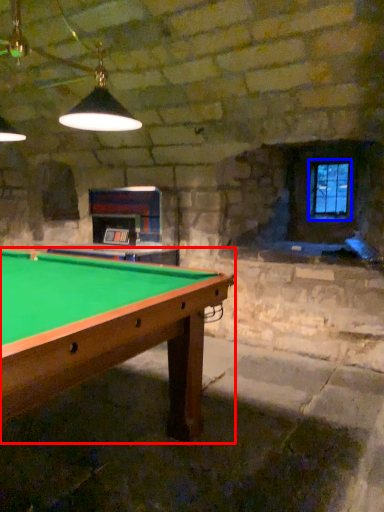
Question: Which of the following is the farthest to the observer, billiard table (highlighted by a red box) or window (highlighted by a blue box)?

Choices:
 (A) billiard table
 (B) window

Answer: (B)